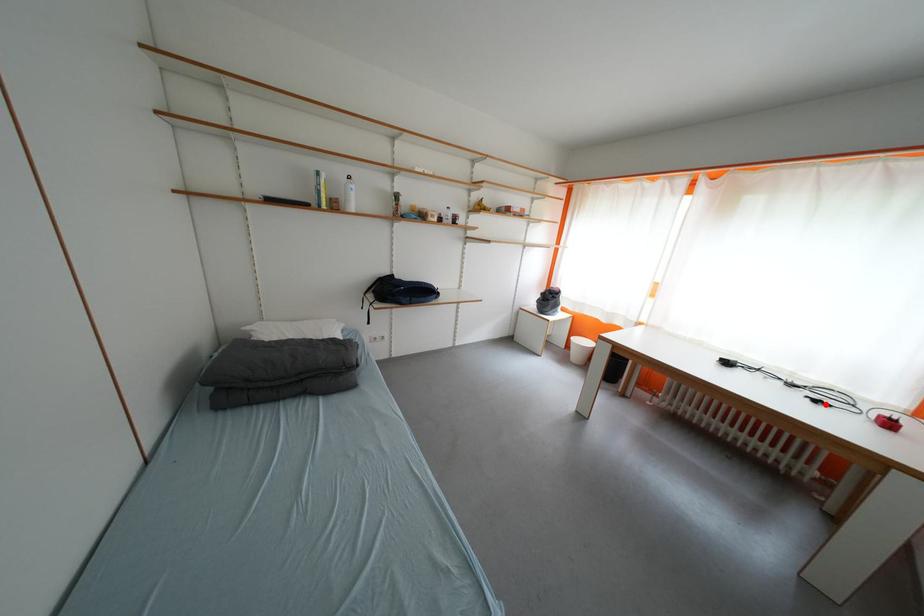
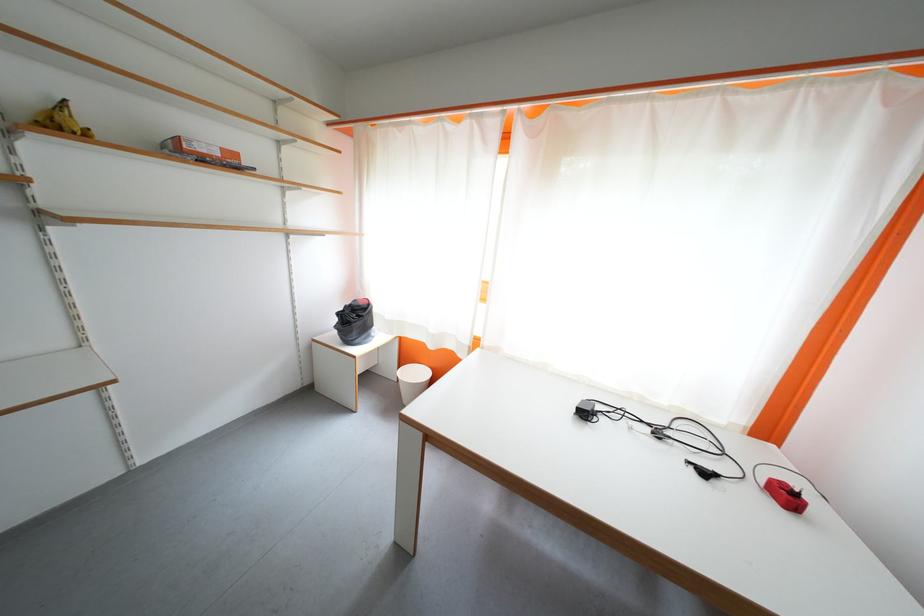
Question: I am providing you with two images of the same scene from different viewpoints. A red point is marked on the first image. Can you still see the location of the red point in image 2?

Choices:
 (A) Yes
 (B) No

Answer: (A)